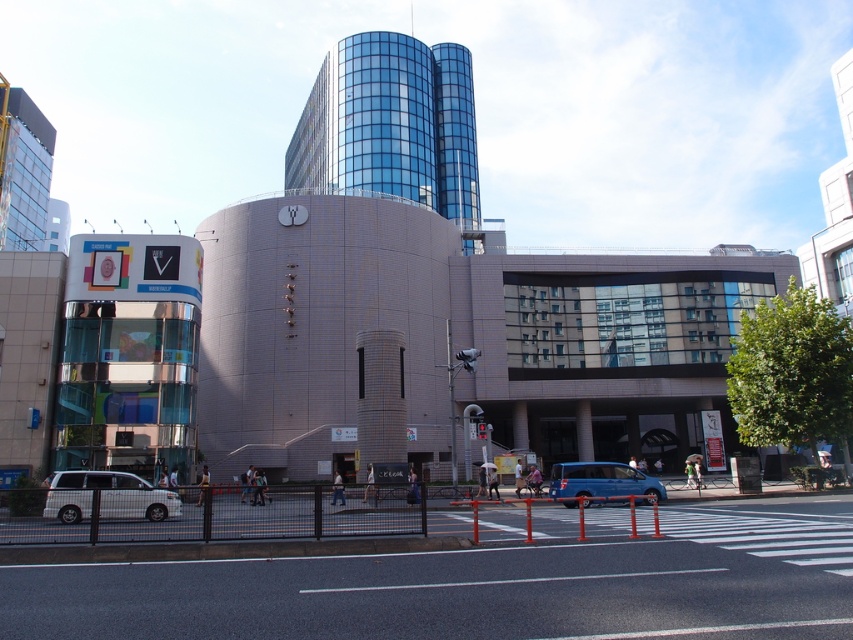
You are a pedestrian standing at the crosswalk in front of the building. You see a white matte van at lower left and a blue metallic van at center. Which van is closer to you?

The white matte van at lower left is closer to you than the blue metallic van at center.

You are a delivery driver who needs to park your vehicle between the white matte van at lower left and the blue metallic van at center. According to the scene, can you park your vehicle there?

The white matte van at lower left is located above the blue metallic van at center, meaning they are stacked vertically. Since parking spaces are typically horizontal, you cannot park your vehicle between them as they are not aligned horizontally.